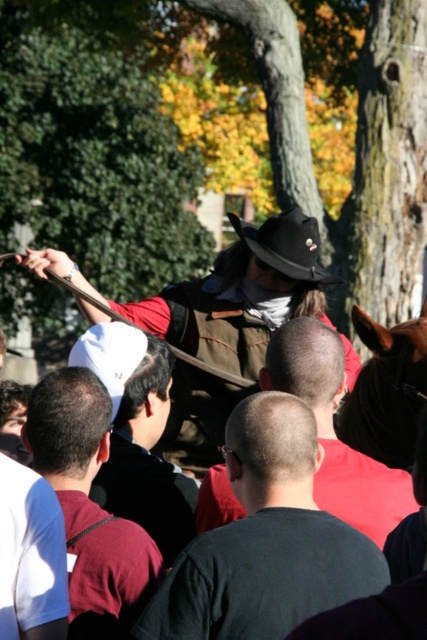
You are a photographer trying to capture a group photo of the black matte shirt at center and the maroon shirt at center. Which of the two should you position closer to the front to ensure both are visible in the photo?

Since the black matte shirt at center is not as tall as maroon shirt at center, you should position the black matte shirt at center closer to the front to ensure both are visible in the photo.

You are standing in the crowd and want to take a photo of both point (x=58, y=499) and point (x=132, y=396). Which point should you focus on first to ensure both are in focus?

You should focus on point (x=58, y=499) first because it is closer to the viewer, ensuring both points are within the depth of field.